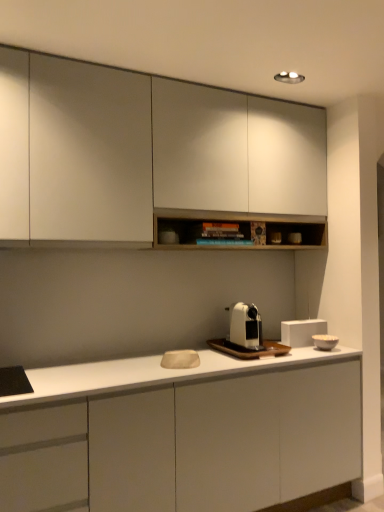
The height and width of the screenshot is (512, 384). In order to click on matte white cabinet at upper center, which is the 2th cabinetry in bottom-to-top order in this screenshot , I will do `click(145, 154)`.

Measure the distance between point (0, 504) and camera.

A distance of 5.45 feet exists between point (0, 504) and camera.

Locate an element on the screen. matte white cabinet at upper center, which is counted as the first cabinetry, starting from the top is located at coordinates (145, 154).

Does white matte rectangular box at center, which ranks as the first appliance in back-to-front order, turn towards white matte coffee machine at center?

No.

Which object is closer to the camera, white matte rectangular box at center, the second appliance positioned from the front, or white matte coffee machine at center?

white matte coffee machine at center is in front.

Are white matte rectangular box at center, which ranks as the first appliance in back-to-front order, and white matte coffee machine at center far apart?

Actually, white matte rectangular box at center, which ranks as the first appliance in back-to-front order, and white matte coffee machine at center are a little close together.

Is matte white cabinet at upper center, which is counted as the first cabinetry, starting from the top, next to white matte bowl at right, placed as the 2th appliance when sorted from back to front, and touching it?

No.

In terms of width, does matte white cabinet at upper center, which is the 2th cabinetry in bottom-to-top order, look wider or thinner when compared to white matte bowl at right, placed as the 2th appliance when sorted from back to front?

Clearly, matte white cabinet at upper center, which is the 2th cabinetry in bottom-to-top order, has more width compared to white matte bowl at right, placed as the 2th appliance when sorted from back to front.

Considering the sizes of objects matte white cabinet at upper center, which is the 2th cabinetry in bottom-to-top order, and white matte bowl at right, positioned as the first appliance in front-to-back order, in the image provided, who is smaller, matte white cabinet at upper center, which is the 2th cabinetry in bottom-to-top order, or white matte bowl at right, positioned as the first appliance in front-to-back order,?

white matte bowl at right, positioned as the first appliance in front-to-back order, is smaller.

Between matte white cabinet at upper center, which is counted as the first cabinetry, starting from the top, and white matte bowl at right, positioned as the first appliance in front-to-back order, which one appears on the left side from the viewer's perspective?

From the viewer's perspective, matte white cabinet at upper center, which is counted as the first cabinetry, starting from the top, appears more on the left side.

Is white matte cabinet at center, marked as the 1th cabinetry in a bottom-to-top arrangement, situated inside white matte coffee machine at center or outside?

white matte cabinet at center, marked as the 1th cabinetry in a bottom-to-top arrangement, is not inside white matte coffee machine at center, it's outside.

How many degrees apart are the facing directions of white matte cabinet at center, marked as the 1th cabinetry in a bottom-to-top arrangement, and white matte coffee machine at center?

They differ by 0.00408 degrees in their facing directions.

Based on their sizes in the image, would you say white matte cabinet at center, marked as the 1th cabinetry in a bottom-to-top arrangement, is bigger or smaller than white matte coffee machine at center?

In the image, white matte cabinet at center, marked as the 1th cabinetry in a bottom-to-top arrangement, appears to be larger than white matte coffee machine at center.

Is white matte cabinet at center, which appears as the second cabinetry when viewed from the top, to the left of white matte coffee machine at center from the viewer's perspective?

Correct, you'll find white matte cabinet at center, which appears as the second cabinetry when viewed from the top, to the left of white matte coffee machine at center.

From the image's perspective, which is below, white matte cabinet at center, which appears as the second cabinetry when viewed from the top, or matte white cabinet at upper center, which is the 2th cabinetry in bottom-to-top order?

From the image's view, white matte cabinet at center, which appears as the second cabinetry when viewed from the top, is below.

Is white matte cabinet at center, which appears as the second cabinetry when viewed from the top, outside of matte white cabinet at upper center, which is counted as the first cabinetry, starting from the top?

white matte cabinet at center, which appears as the second cabinetry when viewed from the top, is positioned outside matte white cabinet at upper center, which is counted as the first cabinetry, starting from the top.

In order to click on cabinetry lying above the white matte cabinet at center, marked as the 1th cabinetry in a bottom-to-top arrangement (from the image's perspective) in this screenshot , I will do `click(145, 154)`.

Considering the relative sizes of white matte coffee machine at center and white matte cabinet at center, which appears as the second cabinetry when viewed from the top, in the image provided, is white matte coffee machine at center thinner than white matte cabinet at center, which appears as the second cabinetry when viewed from the top,?

Indeed, white matte coffee machine at center has a lesser width compared to white matte cabinet at center, which appears as the second cabinetry when viewed from the top.

In order to click on home appliance above the white matte cabinet at center, which appears as the second cabinetry when viewed from the top (from a real-world perspective) in this screenshot , I will do `click(245, 326)`.

Is white matte coffee machine at center further to camera compared to white matte cabinet at center, marked as the 1th cabinetry in a bottom-to-top arrangement?

Yes.

Is white matte coffee machine at center oriented away from white matte cabinet at center, marked as the 1th cabinetry in a bottom-to-top arrangement?

No, white matte coffee machine at center is not facing the opposite direction of white matte cabinet at center, marked as the 1th cabinetry in a bottom-to-top arrangement.

Based on the photo, is white matte cabinet at center, marked as the 1th cabinetry in a bottom-to-top arrangement, inside or outside of white matte rectangular box at center, which ranks as the first appliance in back-to-front order?

white matte cabinet at center, marked as the 1th cabinetry in a bottom-to-top arrangement, exists outside the volume of white matte rectangular box at center, which ranks as the first appliance in back-to-front order.

Is white matte cabinet at center, which appears as the second cabinetry when viewed from the top, to the right of white matte rectangular box at center, the second appliance positioned from the front, from the viewer's perspective?

A: No, white matte cabinet at center, which appears as the second cabinetry when viewed from the top, is not to the right of white matte rectangular box at center, the second appliance positioned from the front.

From a real-world perspective, which object stands above the other?

white matte rectangular box at center, the second appliance positioned from the front, is physically above.

From the picture: Is white matte bowl at right, placed as the 2th appliance when sorted from back to front, far from white matte coffee machine at center?

white matte bowl at right, placed as the 2th appliance when sorted from back to front, is near white matte coffee machine at center, not far away.

From the image's perspective, would you say white matte bowl at right, placed as the 2th appliance when sorted from back to front, is shown under white matte coffee machine at center?

Yes.

From a real-world perspective, between white matte bowl at right, placed as the 2th appliance when sorted from back to front, and white matte coffee machine at center, who is vertically higher?

From a 3D spatial view, white matte coffee machine at center is above.

From the image's perspective, count 2nd appliances downward from the white matte coffee machine at center and point to it. Please provide its 2D coordinates.

[(325, 341)]

Which appliance is the 1st one when counting from the right side of the white matte coffee machine at center? Please provide its 2D coordinates.

[(301, 331)]

This screenshot has height=512, width=384. Identify the location of cabinetry above the white matte bowl at right, positioned as the first appliance in front-to-back order (from a real-world perspective). (145, 154).

Based on their spatial positions, is white matte rectangular box at center, which ranks as the first appliance in back-to-front order, or matte white cabinet at upper center, which is the 2th cabinetry in bottom-to-top order, further from white matte cabinet at center, marked as the 1th cabinetry in a bottom-to-top arrangement?

matte white cabinet at upper center, which is the 2th cabinetry in bottom-to-top order, is further to white matte cabinet at center, marked as the 1th cabinetry in a bottom-to-top arrangement.

Estimate the real-world distances between objects in this image. Which object is further from white matte coffee machine at center, white matte bowl at right, positioned as the first appliance in front-to-back order, or white matte rectangular box at center, which ranks as the first appliance in back-to-front order?

Among the two, white matte bowl at right, positioned as the first appliance in front-to-back order, is located further to white matte coffee machine at center.

When comparing their distances from white matte coffee machine at center, does white matte cabinet at center, marked as the 1th cabinetry in a bottom-to-top arrangement, or white matte bowl at right, placed as the 2th appliance when sorted from back to front, seem closer?

white matte bowl at right, placed as the 2th appliance when sorted from back to front, lies closer to white matte coffee machine at center than the other object.

Estimate the real-world distances between objects in this image. Which object is further from white matte cabinet at center, which appears as the second cabinetry when viewed from the top, white matte coffee machine at center or matte white cabinet at upper center, which is the 2th cabinetry in bottom-to-top order?

Based on the image, matte white cabinet at upper center, which is the 2th cabinetry in bottom-to-top order, appears to be further to white matte cabinet at center, which appears as the second cabinetry when viewed from the top.

Estimate the real-world distances between objects in this image. Which object is further from white matte bowl at right, placed as the 2th appliance when sorted from back to front, white matte cabinet at center, which appears as the second cabinetry when viewed from the top, or white matte coffee machine at center?

The object further to white matte bowl at right, placed as the 2th appliance when sorted from back to front, is white matte cabinet at center, which appears as the second cabinetry when viewed from the top.

Considering their positions, is white matte coffee machine at center positioned further to white matte bowl at right, placed as the 2th appliance when sorted from back to front, than matte white cabinet at upper center, which is counted as the first cabinetry, starting from the top?

matte white cabinet at upper center, which is counted as the first cabinetry, starting from the top, lies further to white matte bowl at right, placed as the 2th appliance when sorted from back to front, than the other object.

When comparing their distances from white matte cabinet at center, marked as the 1th cabinetry in a bottom-to-top arrangement, does white matte bowl at right, positioned as the first appliance in front-to-back order, or white matte coffee machine at center seem closer?

white matte coffee machine at center lies closer to white matte cabinet at center, marked as the 1th cabinetry in a bottom-to-top arrangement, than the other object.

Estimate the real-world distances between objects in this image. Which object is further from white matte rectangular box at center, which ranks as the first appliance in back-to-front order, white matte cabinet at center, which appears as the second cabinetry when viewed from the top, or white matte coffee machine at center?

The object further to white matte rectangular box at center, which ranks as the first appliance in back-to-front order, is white matte cabinet at center, which appears as the second cabinetry when viewed from the top.

You are a GUI agent. You are given a task and a screenshot of the screen. Output one action in this format:
    pyautogui.click(x=<x>, y=<y>)
    Task: Click on the appliance between white matte coffee machine at center and white matte bowl at right, placed as the 2th appliance when sorted from back to front, from left to right
    The width and height of the screenshot is (384, 512).
    Given the screenshot: What is the action you would take?
    pyautogui.click(x=301, y=331)

Find the location of `appliance that lies between matte white cabinet at upper center, which is the 2th cabinetry in bottom-to-top order, and white matte bowl at right, positioned as the first appliance in front-to-back order, from top to bottom`. appliance that lies between matte white cabinet at upper center, which is the 2th cabinetry in bottom-to-top order, and white matte bowl at right, positioned as the first appliance in front-to-back order, from top to bottom is located at coordinates (301, 331).

Where is `home appliance between matte white cabinet at upper center, which is the 2th cabinetry in bottom-to-top order, and white matte rectangular box at center, which ranks as the first appliance in back-to-front order, vertically`? The image size is (384, 512). home appliance between matte white cabinet at upper center, which is the 2th cabinetry in bottom-to-top order, and white matte rectangular box at center, which ranks as the first appliance in back-to-front order, vertically is located at coordinates (245, 326).

The height and width of the screenshot is (512, 384). I want to click on home appliance between white matte cabinet at center, which appears as the second cabinetry when viewed from the top, and white matte rectangular box at center, the second appliance positioned from the front, from front to back, so click(245, 326).